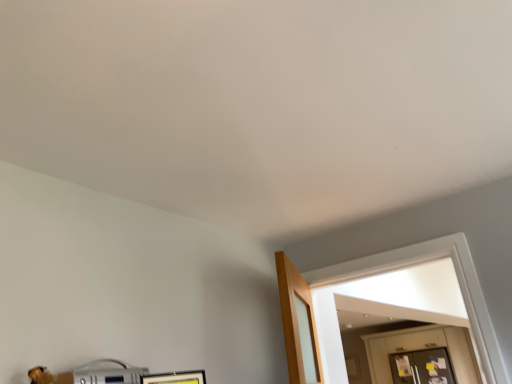
Question: Would you say wooden door at lower right contains clear glass door at right?

Choices:
 (A) no
 (B) yes

Answer: (A)

Question: Could you tell me if wooden door at lower right is facing clear glass door at right?

Choices:
 (A) no
 (B) yes

Answer: (B)

Question: Is wooden door at lower right not inside clear glass door at right?

Choices:
 (A) yes
 (B) no

Answer: (A)

Question: From a real-world perspective, is wooden door at lower right located beneath clear glass door at right?

Choices:
 (A) no
 (B) yes

Answer: (A)

Question: Does wooden door at lower right have a lesser height compared to clear glass door at right?

Choices:
 (A) yes
 (B) no

Answer: (B)

Question: Does wooden door at lower right appear on the right side of clear glass door at right?

Choices:
 (A) yes
 (B) no

Answer: (A)

Question: Does clear glass door at right have a larger size compared to wooden door at lower right?

Choices:
 (A) no
 (B) yes

Answer: (A)

Question: Considering the relative sizes of clear glass door at right and wooden door at lower right in the image provided, is clear glass door at right thinner than wooden door at lower right?

Choices:
 (A) yes
 (B) no

Answer: (A)

Question: From the image's perspective, does clear glass door at right appear higher than wooden door at lower right?

Choices:
 (A) yes
 (B) no

Answer: (B)

Question: Is clear glass door at right positioned in front of wooden door at lower right?

Choices:
 (A) yes
 (B) no

Answer: (B)

Question: Is wooden door at lower right inside clear glass door at right?

Choices:
 (A) no
 (B) yes

Answer: (A)

Question: Is clear glass door at right facing away from wooden door at lower right?

Choices:
 (A) no
 (B) yes

Answer: (B)

Question: Is clear glass door at right in front of or behind wooden door at lower right in the image?

Choices:
 (A) behind
 (B) front

Answer: (A)